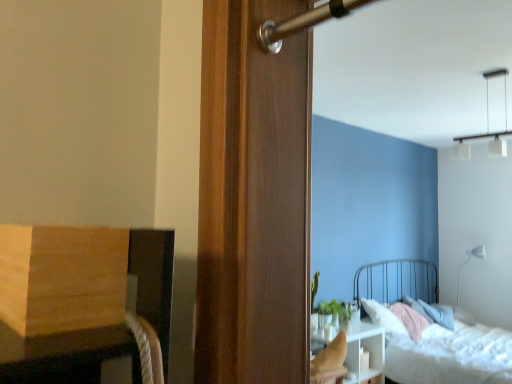
This screenshot has width=512, height=384. In order to click on white matte floor lamp at upper right, arranged as the 2th light fixture when viewed from the top in this screenshot , I will do `click(468, 261)`.

What do you see at coordinates (487, 125) in the screenshot? I see `white glass pendant lights at upper right, which appears as the second light fixture when viewed from the back` at bounding box center [487, 125].

What do you see at coordinates (451, 356) in the screenshot? The image size is (512, 384). I see `white textured bed at lower right` at bounding box center [451, 356].

The image size is (512, 384). Describe the element at coordinates (334, 313) in the screenshot. I see `green matte plant at center` at that location.

Where is `white matte floor lamp at upper right, arranged as the 2th light fixture when viewed from the top`? This screenshot has width=512, height=384. white matte floor lamp at upper right, arranged as the 2th light fixture when viewed from the top is located at coordinates (468, 261).

Between white textured bed at lower right and white glossy nightstand at lower right, which one has larger size?

With larger size is white textured bed at lower right.

Are white textured bed at lower right and white glossy nightstand at lower right far apart?

No, white textured bed at lower right is not far away from white glossy nightstand at lower right.

From the image's perspective, is white textured bed at lower right located above or below white glossy nightstand at lower right?

Based on their image positions, white textured bed at lower right is located above white glossy nightstand at lower right.

Is the surface of white glass pendant lights at upper right, which is the first light fixture in top-to-bottom order, in direct contact with white glossy nightstand at lower right?

No, white glass pendant lights at upper right, which is the first light fixture in top-to-bottom order, is not making contact with white glossy nightstand at lower right.

Which point is more forward, (457, 146) or (384, 353)?

The point (384, 353) is more forward.

Considering the relative sizes of white glass pendant lights at upper right, the first light fixture from the front, and white glossy nightstand at lower right in the image provided, is white glass pendant lights at upper right, the first light fixture from the front, smaller than white glossy nightstand at lower right?

Yes.

Does white glass pendant lights at upper right, which appears as the second light fixture when viewed from the back, have a lesser width compared to white glossy nightstand at lower right?

Yes.

Based on the photo, how many degrees apart are the facing directions of white glossy nightstand at lower right and white matte floor lamp at upper right, arranged as the 2th light fixture when viewed from the top?

85.4 degrees.

Is white glossy nightstand at lower right facing towards white matte floor lamp at upper right, the 2th light fixture positioned from the front?

No, white glossy nightstand at lower right is not oriented towards white matte floor lamp at upper right, the 2th light fixture positioned from the front.

In the image, is white glossy nightstand at lower right positioned in front of or behind white matte floor lamp at upper right, arranged as the 2th light fixture when viewed from the top?

Visually, white glossy nightstand at lower right is located in front of white matte floor lamp at upper right, arranged as the 2th light fixture when viewed from the top.

Who is smaller, white glossy nightstand at lower right or white matte floor lamp at upper right, the 1th light fixture when ordered from right to left?

With smaller size is white matte floor lamp at upper right, the 1th light fixture when ordered from right to left.

From the image's perspective, is white textured bed at lower right located above or below white glass pendant lights at upper right, which is the first light fixture in top-to-bottom order?

From the image's perspective, white textured bed at lower right appears below white glass pendant lights at upper right, which is the first light fixture in top-to-bottom order.

From a real-world perspective, who is located lower, white textured bed at lower right or white glass pendant lights at upper right, the first light fixture from the front?

In real-world perspective, white textured bed at lower right is lower.

Is white textured bed at lower right wider than white glass pendant lights at upper right, which is the first light fixture in top-to-bottom order?

Yes.

Looking at this image, is white textured bed at lower right far from white glass pendant lights at upper right, the first light fixture from the front?

white textured bed at lower right is far away from white glass pendant lights at upper right, the first light fixture from the front.

Image resolution: width=512 pixels, height=384 pixels. Find the location of `nightstand behind the white glass pendant lights at upper right, placed as the first light fixture when sorted from left to right`. nightstand behind the white glass pendant lights at upper right, placed as the first light fixture when sorted from left to right is located at coordinates (367, 351).

Is white glossy nightstand at lower right inside the boundaries of white glass pendant lights at upper right, which is the second light fixture in right-to-left order, or outside?

white glossy nightstand at lower right cannot be found inside white glass pendant lights at upper right, which is the second light fixture in right-to-left order.

From a real-world perspective, is white glossy nightstand at lower right physically below white glass pendant lights at upper right, placed as the first light fixture when sorted from left to right?

Yes, from a real-world perspective, white glossy nightstand at lower right is below white glass pendant lights at upper right, placed as the first light fixture when sorted from left to right.

In the image, is white glossy nightstand at lower right positioned in front of or behind white glass pendant lights at upper right, which is the first light fixture in top-to-bottom order?

white glossy nightstand at lower right is positioned farther from the viewer than white glass pendant lights at upper right, which is the first light fixture in top-to-bottom order.

Considering the relative sizes of white glossy nightstand at lower right and green matte plant at center in the image provided, is white glossy nightstand at lower right smaller than green matte plant at center?

No.

Which object is closer to the camera, white glossy nightstand at lower right or green matte plant at center?

white glossy nightstand at lower right.

Which is more to the right, white glossy nightstand at lower right or green matte plant at center?

white glossy nightstand at lower right.

Based on the photo, considering the sizes of objects white glass pendant lights at upper right, which is the second light fixture from bottom to top, and white matte floor lamp at upper right, the first light fixture when ordered from back to front, in the image provided, who is smaller, white glass pendant lights at upper right, which is the second light fixture from bottom to top, or white matte floor lamp at upper right, the first light fixture when ordered from back to front,?

white glass pendant lights at upper right, which is the second light fixture from bottom to top.

What's the angular difference between white glass pendant lights at upper right, which is the first light fixture in top-to-bottom order, and white matte floor lamp at upper right, the 2th light fixture positioned from the front,'s facing directions?

The angular difference between white glass pendant lights at upper right, which is the first light fixture in top-to-bottom order, and white matte floor lamp at upper right, the 2th light fixture positioned from the front, is 5.31 degrees.

Which is farther, (494, 76) or (468, 260)?

The point (468, 260) is more distant.

From the image's perspective, which one is positioned lower, white glass pendant lights at upper right, which is the second light fixture from bottom to top, or white matte floor lamp at upper right, the first light fixture when ordered from bottom to top?

white matte floor lamp at upper right, the first light fixture when ordered from bottom to top, appears lower in the image.

The width and height of the screenshot is (512, 384). Identify the location of bed lying above the white glossy nightstand at lower right (from the image's perspective). (451, 356).

Image resolution: width=512 pixels, height=384 pixels. What are the coordinates of `nightstand below the white glass pendant lights at upper right, placed as the first light fixture when sorted from left to right (from a real-world perspective)` in the screenshot? It's located at (367, 351).

Which object lies further to the anchor point white textured bed at lower right, white glass pendant lights at upper right, which is the first light fixture in top-to-bottom order, or white matte floor lamp at upper right, the 1th light fixture when ordered from right to left?

white glass pendant lights at upper right, which is the first light fixture in top-to-bottom order, lies further to white textured bed at lower right than the other object.

Considering their positions, is white glass pendant lights at upper right, which is the second light fixture in right-to-left order, positioned further to white glossy nightstand at lower right than white textured bed at lower right?

The object further to white glossy nightstand at lower right is white glass pendant lights at upper right, which is the second light fixture in right-to-left order.

Based on their spatial positions, is white textured bed at lower right or green matte plant at center further from white matte floor lamp at upper right, which is counted as the 2th light fixture, starting from the left?

The object further to white matte floor lamp at upper right, which is counted as the 2th light fixture, starting from the left, is green matte plant at center.

Which object lies further to the anchor point white matte floor lamp at upper right, the first light fixture when ordered from bottom to top, white glossy nightstand at lower right or white glass pendant lights at upper right, which appears as the second light fixture when viewed from the back?

white glass pendant lights at upper right, which appears as the second light fixture when viewed from the back, is positioned further to the anchor white matte floor lamp at upper right, the first light fixture when ordered from bottom to top.

Looking at the image, which one is located closer to white matte floor lamp at upper right, the first light fixture when ordered from bottom to top, green matte plant at center or white textured bed at lower right?

Based on the image, white textured bed at lower right appears to be nearer to white matte floor lamp at upper right, the first light fixture when ordered from bottom to top.

Considering their positions, is white glass pendant lights at upper right, placed as the first light fixture when sorted from left to right, positioned further to white matte floor lamp at upper right, the first light fixture when ordered from bottom to top, than white glossy nightstand at lower right?

white glass pendant lights at upper right, placed as the first light fixture when sorted from left to right, lies further to white matte floor lamp at upper right, the first light fixture when ordered from bottom to top, than the other object.

Estimate the real-world distances between objects in this image. Which object is closer to white matte floor lamp at upper right, the first light fixture when ordered from back to front, white textured bed at lower right or white glass pendant lights at upper right, which is the second light fixture in right-to-left order?

Based on the image, white textured bed at lower right appears to be nearer to white matte floor lamp at upper right, the first light fixture when ordered from back to front.

Which object lies nearer to the anchor point white textured bed at lower right, white matte floor lamp at upper right, the first light fixture when ordered from bottom to top, or white glossy nightstand at lower right?

The object closer to white textured bed at lower right is white glossy nightstand at lower right.

I want to click on bed situated between green matte plant at center and white matte floor lamp at upper right, the first light fixture when ordered from bottom to top, from left to right, so click(451, 356).

Where is `bed between white glass pendant lights at upper right, which is the first light fixture in top-to-bottom order, and white glossy nightstand at lower right vertically`? The height and width of the screenshot is (384, 512). bed between white glass pendant lights at upper right, which is the first light fixture in top-to-bottom order, and white glossy nightstand at lower right vertically is located at coordinates (451, 356).

This screenshot has width=512, height=384. Identify the location of plant between white glass pendant lights at upper right, which is the second light fixture in right-to-left order, and white textured bed at lower right in the up-down direction. (334, 313).

Locate an element on the screen. This screenshot has width=512, height=384. nightstand between green matte plant at center and white textured bed at lower right in the horizontal direction is located at coordinates (367, 351).